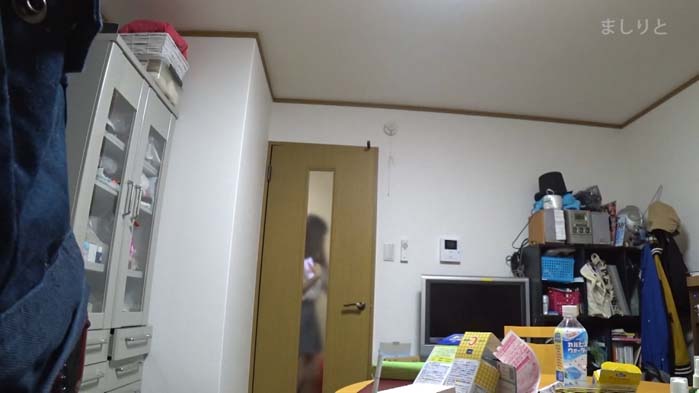
You are a GUI agent. You are given a task and a screenshot of the screen. Output one action in this format:
    pyautogui.click(x=<x>, y=<y>)
    Task: Click on the door handle/knob
    This screenshot has width=699, height=393.
    Given the screenshot: What is the action you would take?
    pyautogui.click(x=350, y=302)